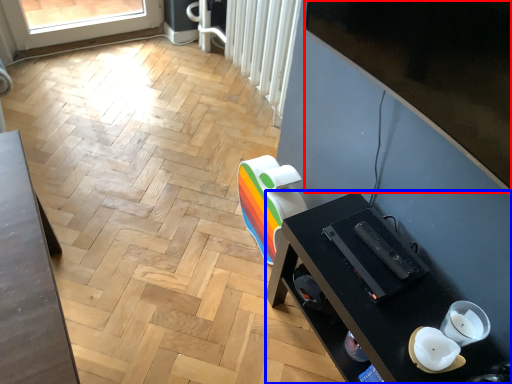
Question: Which of the following is the farthest to the observer, window screen (highlighted by a red box) or desk (highlighted by a blue box)?

Choices:
 (A) window screen
 (B) desk

Answer: (B)